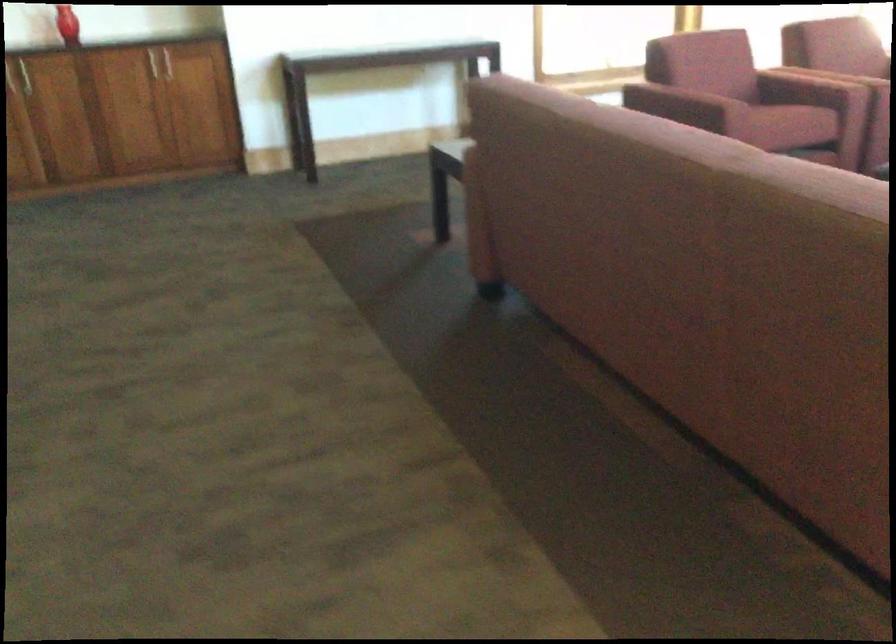
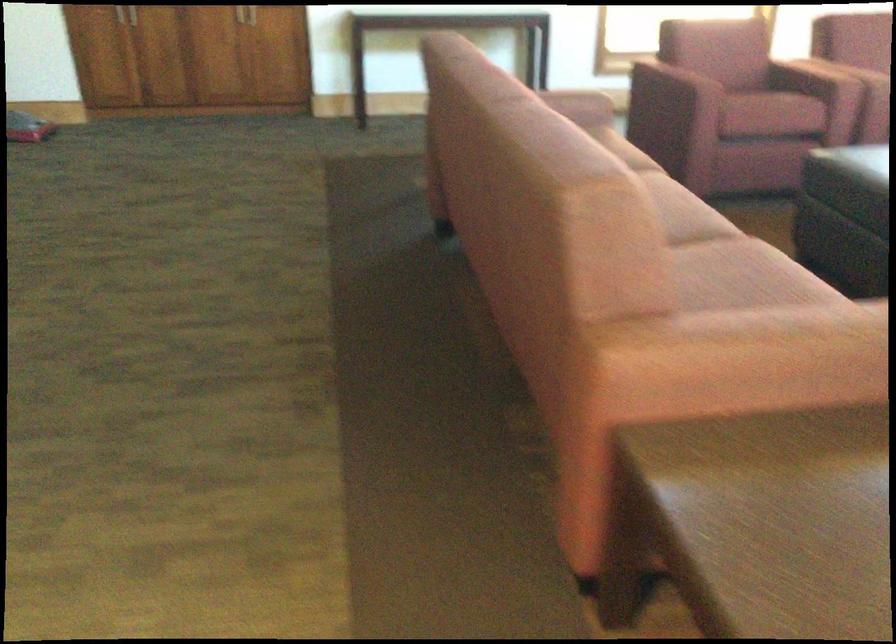
Question: In a continuous first-person perspective shot, in which direction is the camera moving?

Choices:
 (A) Left
 (B) Right
 (C) Forward
 (D) Backward

Answer: (B)